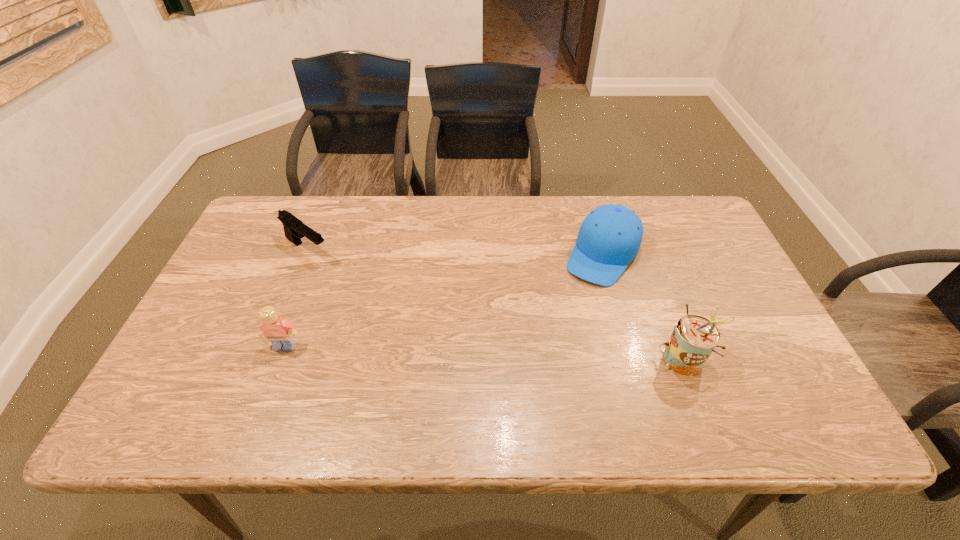
Find the location of a particular element. The image size is (960, 540). free point located 0.150m on the front-facing side of the pistol is located at coordinates (360, 285).

Identify the location of free location located on the front-facing side of the pistol. (382, 301).

At what (x,y) coordinates should I click in order to perform the action: click on cap at the far edge. Please return your answer as a coordinate pair (x, y). Looking at the image, I should click on (609, 238).

Where is `pistol at the far edge`? pistol at the far edge is located at coordinates (294, 229).

Find the location of a particular element. This screenshot has height=540, width=960. object at the near edge is located at coordinates (694, 338).

Locate an element on the screen. object positioned at the left edge is located at coordinates (294, 229).

Locate an element on the screen. This screenshot has width=960, height=540. object at the far left corner is located at coordinates (294, 229).

The image size is (960, 540). I want to click on free region at the far edge, so click(x=445, y=217).

Locate an element on the screen. The height and width of the screenshot is (540, 960). vacant region at the near edge of the desktop is located at coordinates (481, 366).

This screenshot has height=540, width=960. In the image, there is a desktop. Identify the location of free region at the left edge. (251, 342).